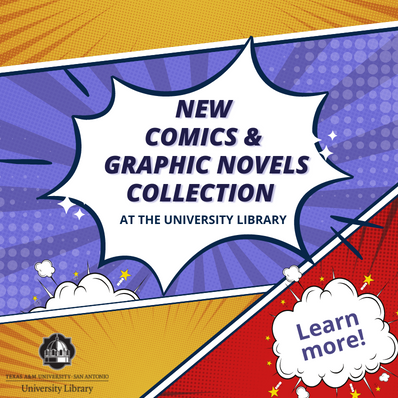
Locate an element on the screen. The width and height of the screenshot is (398, 398). library is located at coordinates (78, 391).